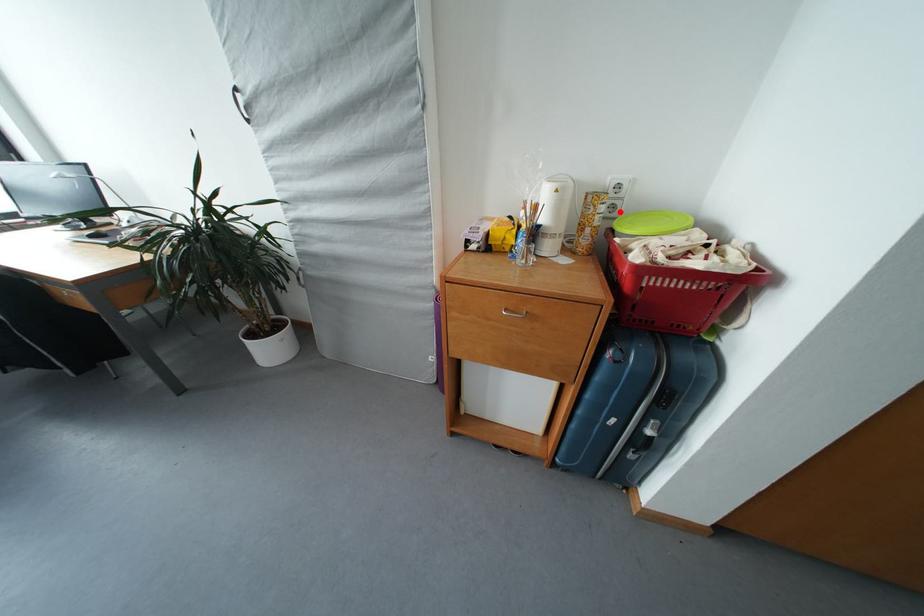
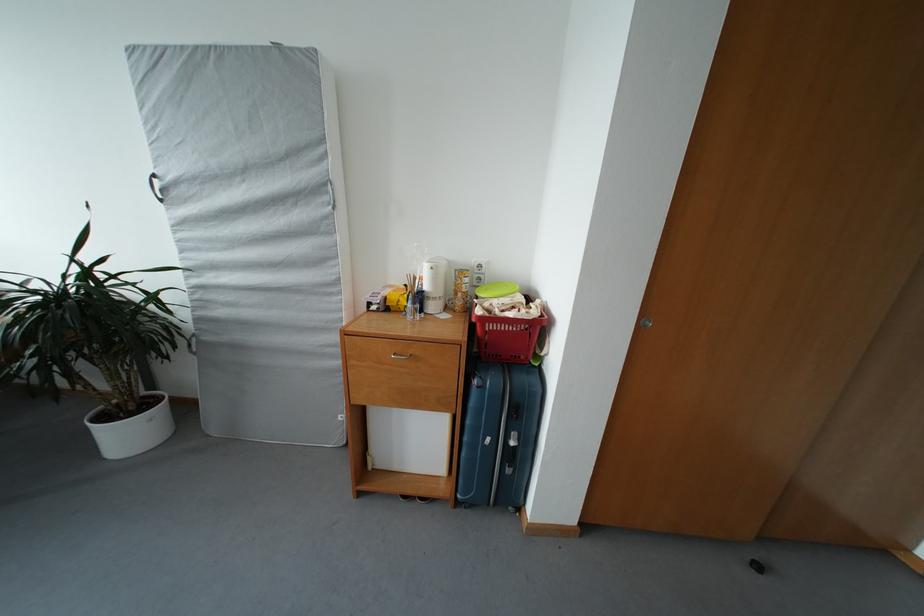
Find the pixel in the second image that matches the highlighted location in the first image.

(485, 284)